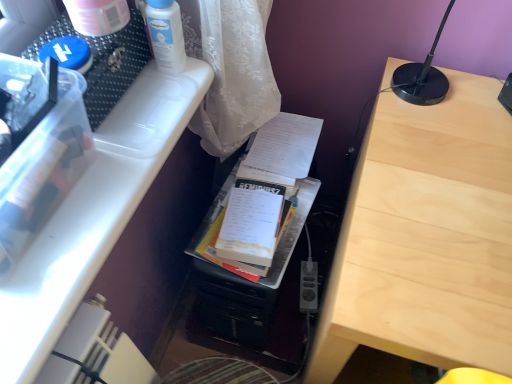
Question: From a real-world perspective, is light wood table at center located higher than white plastic container at upper left?

Choices:
 (A) no
 (B) yes

Answer: (A)

Question: Can you confirm if light wood table at center is smaller than white plastic container at upper left?

Choices:
 (A) no
 (B) yes

Answer: (A)

Question: From the image's perspective, is light wood table at center under white plastic container at upper left?

Choices:
 (A) yes
 (B) no

Answer: (A)

Question: Is light wood table at center to the left of white plastic container at upper left from the viewer's perspective?

Choices:
 (A) yes
 (B) no

Answer: (B)

Question: Could you tell me if light wood table at center is facing white plastic container at upper left?

Choices:
 (A) no
 (B) yes

Answer: (A)

Question: Is white paper at center bigger or smaller than white plastic container at upper left?

Choices:
 (A) small
 (B) big

Answer: (A)

Question: Would you say white paper at center is to the left or to the right of white plastic container at upper left in the picture?

Choices:
 (A) left
 (B) right

Answer: (B)

Question: Is white paper at center wider or thinner than white plastic container at upper left?

Choices:
 (A) wide
 (B) thin

Answer: (A)

Question: Is white paper at center spatially inside white plastic container at upper left, or outside of it?

Choices:
 (A) inside
 (B) outside

Answer: (B)

Question: From a real-world perspective, is light wood table at center positioned above or below white paper at center?

Choices:
 (A) above
 (B) below

Answer: (B)

Question: In terms of size, does light wood table at center appear bigger or smaller than white paper at center?

Choices:
 (A) big
 (B) small

Answer: (A)

Question: Looking at their shapes, would you say light wood table at center is wider or thinner than white paper at center?

Choices:
 (A) thin
 (B) wide

Answer: (B)

Question: From the image's perspective, is light wood table at center above or below white paper at center?

Choices:
 (A) below
 (B) above

Answer: (A)

Question: In the image, is white glossy lotion at upper center positioned in front of or behind black plastic power plugs and sockets at lower center?

Choices:
 (A) front
 (B) behind

Answer: (A)

Question: Would you say white glossy lotion at upper center is to the left or to the right of black plastic power plugs and sockets at lower center in the picture?

Choices:
 (A) right
 (B) left

Answer: (B)